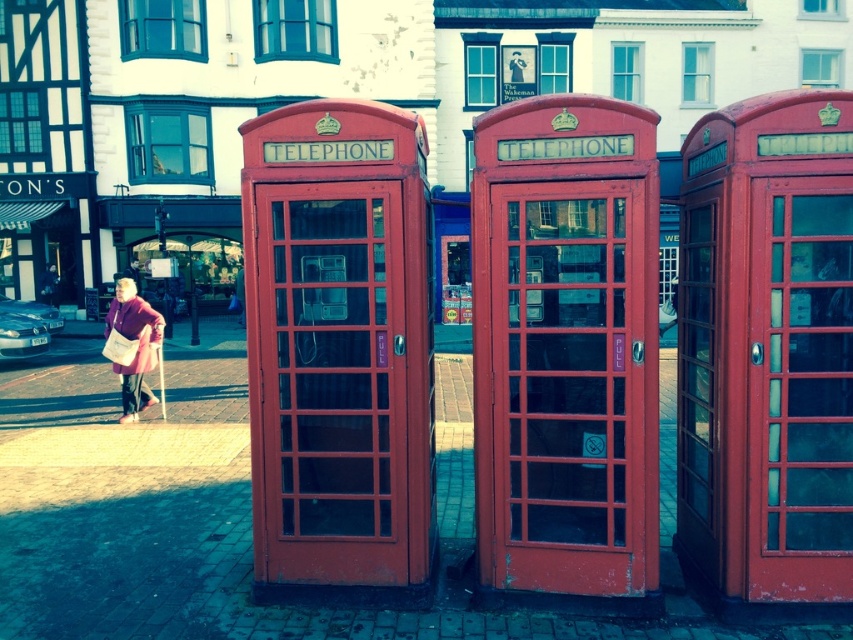
Question: Which object is closer to the camera taking this photo?

Choices:
 (A) matte purple coat at lower left
 (B) light brown leather jacket at center

Answer: (A)

Question: Can you confirm if matte purple coat at lower left is positioned to the right of light brown leather jacket at center?

Choices:
 (A) yes
 (B) no

Answer: (B)

Question: Among these objects, which one is nearest to the camera?

Choices:
 (A) matte purple coat at lower left
 (B) light brown leather jacket at center

Answer: (A)

Question: Does matte purple coat at lower left lie in front of light brown leather jacket at center?

Choices:
 (A) yes
 (B) no

Answer: (A)

Question: Can you confirm if matte purple coat at lower left is positioned to the right of light brown leather jacket at center?

Choices:
 (A) no
 (B) yes

Answer: (A)